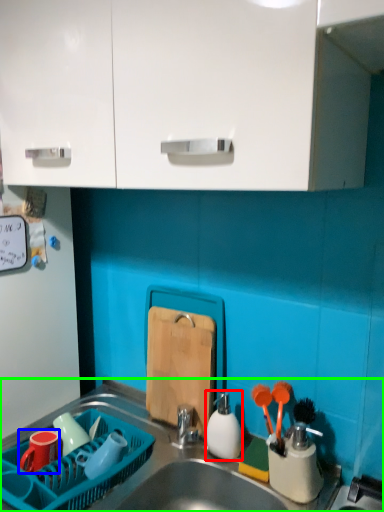
Question: Considering the real-world distances, which object is farthest from tableware (highlighted by a red box)? tableware (highlighted by a blue box) or sink (highlighted by a green box)?

Choices:
 (A) tableware
 (B) sink

Answer: (A)